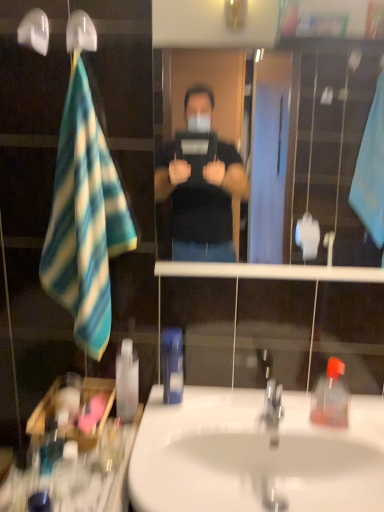
Locate an element on the screen. The image size is (384, 512). white plastic shower head at upper left is located at coordinates (80, 32).

I want to click on translucent plastic mouthwash at lower left, the second mouthwash positioned from the left, so click(x=127, y=382).

In order to click on translucent plastic mouthwash at lower left, which is the 3th mouthwash in right-to-left order in this screenshot , I will do `click(69, 479)`.

In order to face translucent plastic mouthwash at lower left, the third mouthwash positioned from the back, should I rotate leftwards or rightwards?

Turn left approximately 15.892 degrees to face it.

This screenshot has width=384, height=512. What do you see at coordinates (172, 365) in the screenshot?
I see `blue plastic mouthwash at center, the second mouthwash when ordered from front to back` at bounding box center [172, 365].

The width and height of the screenshot is (384, 512). Identify the location of white plastic shower head at upper left. (80, 32).

From a real-world perspective, which object stands above the other?

white plastic shower head at upper left is physically above.

Where is `shower that is on the left side of translucent plastic mouthwash at lower left, which is counted as the 2th mouthwash, starting from the right`? The height and width of the screenshot is (512, 384). shower that is on the left side of translucent plastic mouthwash at lower left, which is counted as the 2th mouthwash, starting from the right is located at coordinates (80, 32).

Is white plastic shower head at upper left touching translucent plastic mouthwash at lower left, which is counted as the 2th mouthwash, starting from the right?

No, white plastic shower head at upper left is not next to translucent plastic mouthwash at lower left, which is counted as the 2th mouthwash, starting from the right.

Which is in front, white plastic shower head at upper left or translucent plastic mouthwash at lower left, placed as the third mouthwash when sorted from front to back?

Positioned in front is white plastic shower head at upper left.

From a real-world perspective, who is located higher, clear glass mirror at center or translucent plastic mouthwash at lower left, which is the 1th mouthwash from back to front?

clear glass mirror at center is physically above.

Between clear glass mirror at center and translucent plastic mouthwash at lower left, placed as the third mouthwash when sorted from front to back, which one appears on the right side from the viewer's perspective?

clear glass mirror at center is more to the right.

Which is correct: clear glass mirror at center is inside translucent plastic mouthwash at lower left, the second mouthwash positioned from the left, or outside of it?

clear glass mirror at center is outside translucent plastic mouthwash at lower left, the second mouthwash positioned from the left.

Which point is more distant from viewer, (345, 222) or (124, 377)?

The point (345, 222) is farther from the camera.

Consider the image. How many degrees apart are the facing directions of blue and white striped towel at left and blue plastic mouthwash at center, the second mouthwash when ordered from front to back?

2.81 degrees.

Is blue and white striped towel at left bigger or smaller than blue plastic mouthwash at center, which appears as the second mouthwash when viewed from the back?

In the image, blue and white striped towel at left appears to be larger than blue plastic mouthwash at center, which appears as the second mouthwash when viewed from the back.

From a real-world perspective, is blue and white striped towel at left physically above blue plastic mouthwash at center, marked as the first mouthwash in a right-to-left arrangement?

Yes, from a real-world perspective, blue and white striped towel at left is above blue plastic mouthwash at center, marked as the first mouthwash in a right-to-left arrangement.

Are blue and white striped towel at left and blue plastic mouthwash at center, marked as the first mouthwash in a right-to-left arrangement, beside each other?

No, blue and white striped towel at left is not beside blue plastic mouthwash at center, marked as the first mouthwash in a right-to-left arrangement.

Is white glossy sink at center outside of clear glass mirror at center?

Yes, white glossy sink at center is located beyond the bounds of clear glass mirror at center.

Is white glossy sink at center not close to clear glass mirror at center?

Indeed, white glossy sink at center is not near clear glass mirror at center.

Does point (166, 331) appear closer or farther from the camera than point (59, 464)?

Point (166, 331) is farther from the camera than point (59, 464).

Is blue plastic mouthwash at center, the second mouthwash when ordered from front to back, facing towards translucent plastic mouthwash at lower left, positioned as the 1th mouthwash in front-to-back order?

No.

Which of these two, blue plastic mouthwash at center, the third mouthwash from the left, or translucent plastic mouthwash at lower left, which is the 3th mouthwash in right-to-left order, stands taller?

blue plastic mouthwash at center, the third mouthwash from the left.

Consider the image. From a real-world perspective, is blue plastic mouthwash at center, marked as the first mouthwash in a right-to-left arrangement, positioned under translucent plastic mouthwash at lower left, the third mouthwash positioned from the back, based on gravity?

Actually, blue plastic mouthwash at center, marked as the first mouthwash in a right-to-left arrangement, is physically above translucent plastic mouthwash at lower left, the third mouthwash positioned from the back, in the real world.

Does translucent plastic mouthwash at lower left, positioned as the first mouthwash in left-to-right order, turn towards white glossy sink at center?

No, translucent plastic mouthwash at lower left, positioned as the first mouthwash in left-to-right order, is not turned towards white glossy sink at center.

Which is more to the right, translucent plastic mouthwash at lower left, positioned as the first mouthwash in left-to-right order, or white glossy sink at center?

Positioned to the right is white glossy sink at center.

Measure the distance between translucent plastic mouthwash at lower left, positioned as the first mouthwash in left-to-right order, and white glossy sink at center.

A distance of 14.12 inches exists between translucent plastic mouthwash at lower left, positioned as the first mouthwash in left-to-right order, and white glossy sink at center.

The height and width of the screenshot is (512, 384). There is a white glossy sink at center. Identify the location of the 1st mouthwash above it (from a real-world perspective). click(69, 479).

Looking at this image, can translucent plastic soap dispenser at right be found inside white plastic shower head at upper left?

Definitely not — translucent plastic soap dispenser at right is not inside white plastic shower head at upper left.

What are the coordinates of `shower above the translucent plastic soap dispenser at right (from a real-world perspective)` in the screenshot? It's located at (80, 32).

How distant is white plastic shower head at upper left from translucent plastic soap dispenser at right?

A distance of 38.78 inches exists between white plastic shower head at upper left and translucent plastic soap dispenser at right.

Between white plastic shower head at upper left and translucent plastic soap dispenser at right, which one appears on the right side from the viewer's perspective?

Positioned to the right is translucent plastic soap dispenser at right.

Locate an element on the screen. the 2nd mouthwash directly beneath the white plastic shower head at upper left (from a real-world perspective) is located at coordinates (127, 382).

Identify the location of mirror located above the translucent plastic mouthwash at lower left, the second mouthwash positioned from the left (from the image's perspective). tap(324, 138).

When comparing their distances from translucent plastic mouthwash at lower left, the third mouthwash positioned from the back, does white glossy sink at center or blue plastic mouthwash at center, the third mouthwash from the left, seem further?

white glossy sink at center lies further to translucent plastic mouthwash at lower left, the third mouthwash positioned from the back, than the other object.

Looking at the image, which one is located further to translucent plastic mouthwash at lower left, which is the 1th mouthwash from back to front, white glossy sink at center or translucent plastic soap dispenser at right?

The object further to translucent plastic mouthwash at lower left, which is the 1th mouthwash from back to front, is translucent plastic soap dispenser at right.

Considering their positions, is blue and white striped towel at left positioned closer to white plastic shower head at upper left than clear glass mirror at center?

The object closer to white plastic shower head at upper left is blue and white striped towel at left.

Considering their positions, is blue plastic mouthwash at center, the second mouthwash when ordered from front to back, positioned further to blue and white striped towel at left than translucent plastic mouthwash at lower left, positioned as the first mouthwash in left-to-right order?

translucent plastic mouthwash at lower left, positioned as the first mouthwash in left-to-right order, is further to blue and white striped towel at left.

Estimate the real-world distances between objects in this image. Which object is further from translucent plastic mouthwash at lower left, the second mouthwash positioned from the left, blue plastic mouthwash at center, the third mouthwash from the left, or white glossy sink at center?

white glossy sink at center is further to translucent plastic mouthwash at lower left, the second mouthwash positioned from the left.

Considering their positions, is translucent plastic mouthwash at lower left, which is the 3th mouthwash in right-to-left order, positioned further to blue plastic mouthwash at center, the second mouthwash when ordered from front to back, than clear glass mirror at center?

Based on the image, clear glass mirror at center appears to be further to blue plastic mouthwash at center, the second mouthwash when ordered from front to back.

Estimate the real-world distances between objects in this image. Which object is closer to blue plastic mouthwash at center, marked as the first mouthwash in a right-to-left arrangement, translucent plastic mouthwash at lower left, positioned as the first mouthwash in left-to-right order, or translucent plastic mouthwash at lower left, the second mouthwash positioned from the left?

translucent plastic mouthwash at lower left, the second mouthwash positioned from the left.

Considering their positions, is clear glass mirror at center positioned further to white plastic shower head at upper left than blue and white striped towel at left?

The object further to white plastic shower head at upper left is clear glass mirror at center.

Where is `mouthwash between translucent plastic mouthwash at lower left, positioned as the 1th mouthwash in front-to-back order, and translucent plastic mouthwash at lower left, which is the 1th mouthwash from back to front, along the z-axis`? mouthwash between translucent plastic mouthwash at lower left, positioned as the 1th mouthwash in front-to-back order, and translucent plastic mouthwash at lower left, which is the 1th mouthwash from back to front, along the z-axis is located at coordinates (172, 365).

Identify the location of beach towel between clear glass mirror at center and translucent plastic mouthwash at lower left, which is the 1th mouthwash from back to front, in the vertical direction. Image resolution: width=384 pixels, height=512 pixels. (85, 220).

Locate an element on the screen. beach towel that lies between white plastic shower head at upper left and blue plastic mouthwash at center, marked as the first mouthwash in a right-to-left arrangement, from top to bottom is located at coordinates (85, 220).

Identify the location of toiletry that lies between blue and white striped towel at left and white glossy sink at center from top to bottom. The height and width of the screenshot is (512, 384). pos(331,397).